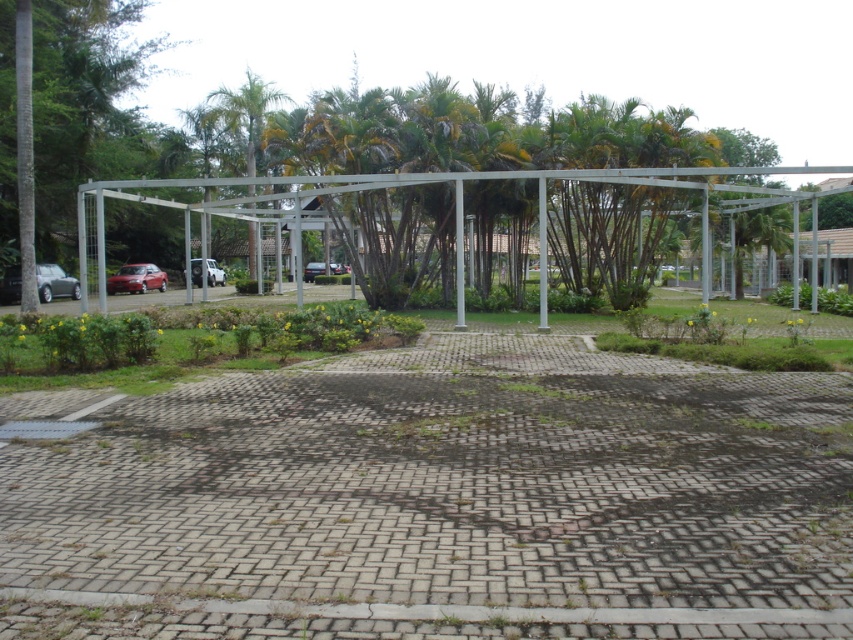
Does satin silver car at lower left have a greater width compared to satin black car at center?

No.

Is point (9, 284) less distant than point (335, 273)?

Yes, point (9, 284) is in front of point (335, 273).

Does point (74, 296) come farther from viewer compared to point (339, 269)?

No, it is in front of (339, 269).

This screenshot has height=640, width=853. In order to click on satin silver car at lower left in this screenshot , I will do `click(55, 282)`.

You are a GUI agent. You are given a task and a screenshot of the screen. Output one action in this format:
    pyautogui.click(x=<x>, y=<y>)
    Task: Click on the shiny red sedan at lower left
    
    Given the screenshot: What is the action you would take?
    pyautogui.click(x=136, y=278)

Is shiny red sedan at lower left thinner than white matte car at center?

Indeed, shiny red sedan at lower left has a lesser width compared to white matte car at center.

At what (x,y) coordinates should I click in order to perform the action: click on shiny red sedan at lower left. Please return your answer as a coordinate pair (x, y). Looking at the image, I should click on (136, 278).

Locate an element on the screen. shiny red sedan at lower left is located at coordinates (136, 278).

Between white matte car at center and satin black car at center, which one has less height?

satin black car at center is shorter.

Describe the element at coordinates (213, 273) in the screenshot. This screenshot has width=853, height=640. I see `white matte car at center` at that location.

Does point (209, 262) come behind point (309, 276)?

No, it is not.

Where is `white matte car at center`? white matte car at center is located at coordinates (213, 273).